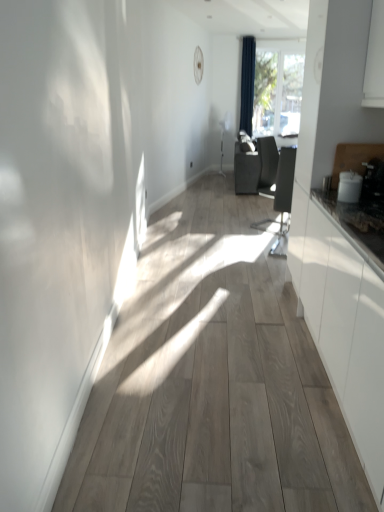
The width and height of the screenshot is (384, 512). I want to click on vacant space that is to the left of matte black swivel chair at center, so click(x=242, y=239).